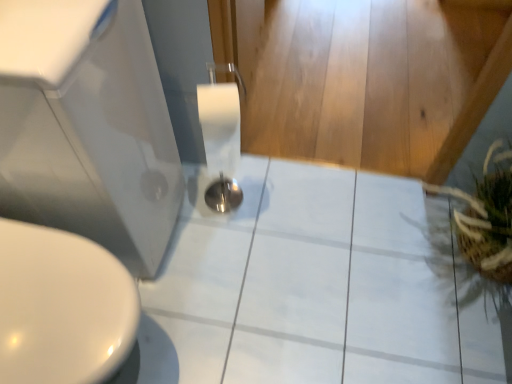
Question: Can you confirm if brown woven basket at right is smaller than white glossy sink at lower left?

Choices:
 (A) no
 (B) yes

Answer: (B)

Question: From a real-world perspective, is brown woven basket at right on white glossy sink at lower left?

Choices:
 (A) yes
 (B) no

Answer: (B)

Question: From the image's perspective, is brown woven basket at right located above white glossy sink at lower left?

Choices:
 (A) no
 (B) yes

Answer: (A)

Question: Is brown woven basket at right wider than white glossy sink at lower left?

Choices:
 (A) yes
 (B) no

Answer: (B)

Question: Is brown woven basket at right far from white glossy sink at lower left?

Choices:
 (A) no
 (B) yes

Answer: (B)

Question: Is brown woven basket at right thinner than white glossy sink at lower left?

Choices:
 (A) no
 (B) yes

Answer: (B)

Question: Is white glossy tile at center outside brown woven basket at right?

Choices:
 (A) no
 (B) yes

Answer: (B)

Question: Is white glossy tile at center behind brown woven basket at right?

Choices:
 (A) no
 (B) yes

Answer: (B)

Question: Is white glossy tile at center thinner than brown woven basket at right?

Choices:
 (A) no
 (B) yes

Answer: (A)

Question: From a real-world perspective, is white glossy tile at center located beneath brown woven basket at right?

Choices:
 (A) no
 (B) yes

Answer: (B)

Question: Does white glossy tile at center have a larger size compared to brown woven basket at right?

Choices:
 (A) no
 (B) yes

Answer: (A)

Question: Considering the relative sizes of white glossy tile at center and brown woven basket at right in the image provided, is white glossy tile at center taller than brown woven basket at right?

Choices:
 (A) yes
 (B) no

Answer: (B)

Question: From the image's perspective, would you say white glossy tile at center is shown under white glossy sink at lower left?

Choices:
 (A) yes
 (B) no

Answer: (A)